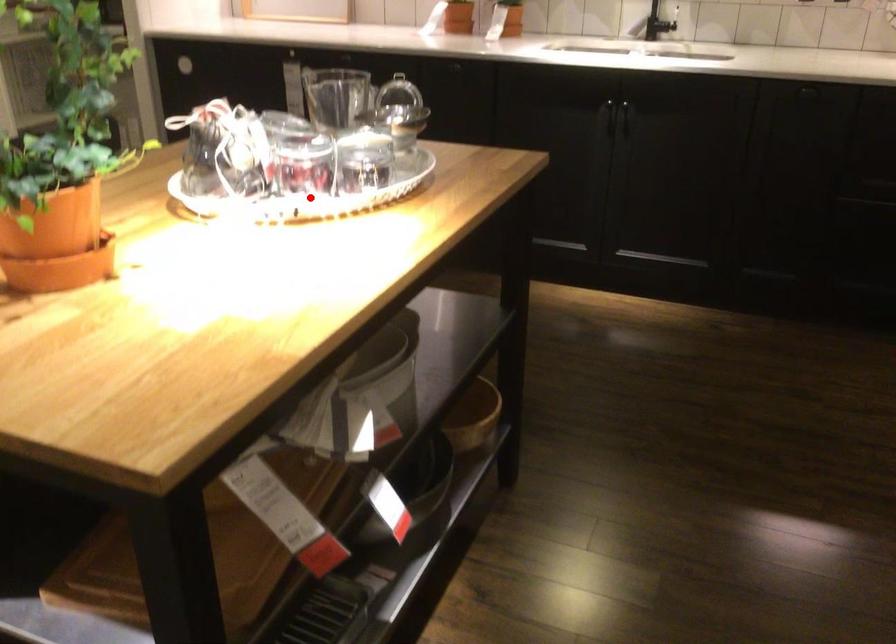
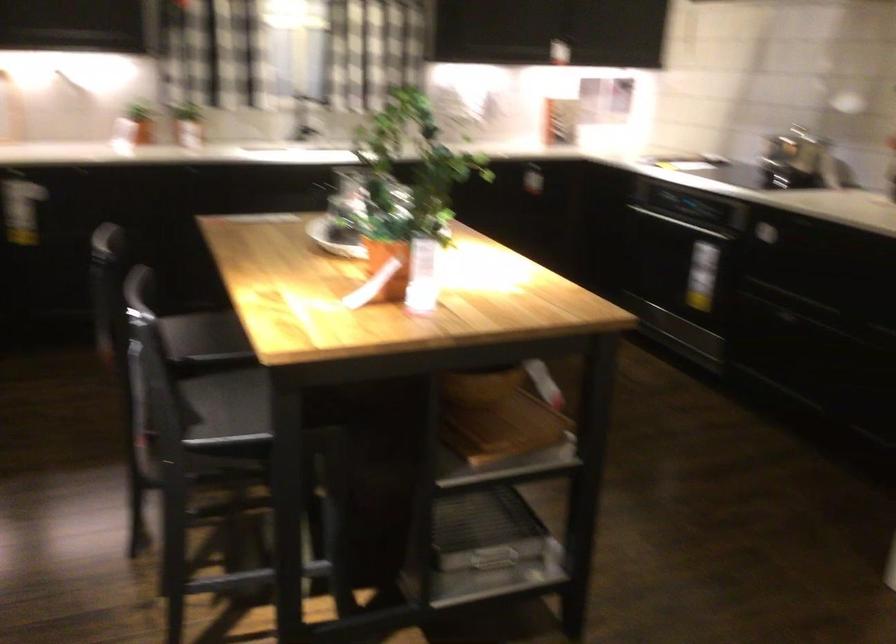
Question: I am providing you with two images of the same scene from different viewpoints. A red point is marked on the first image. Can you still see the location of the red point in image 2?

Choices:
 (A) Yes
 (B) No

Answer: (B)